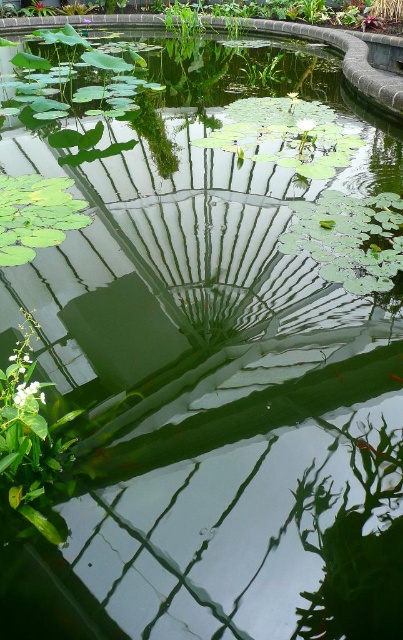
Does green leafy plant at lower right have a greater height compared to green leafy plant at upper center?

Incorrect, green leafy plant at lower right's height is not larger of green leafy plant at upper center's.

Is green leafy plant at lower right below green leafy plant at upper center?

Yes, green leafy plant at lower right is below green leafy plant at upper center.

Does point (386, 604) come behind point (342, 26)?

No.

Where is `green leafy plant at lower right`? green leafy plant at lower right is located at coordinates (355, 544).

Is green leafy plant at lower right thinner than green glossy lily pad at upper left?

Yes, green leafy plant at lower right is thinner than green glossy lily pad at upper left.

Which of these two, green leafy plant at lower right or green glossy lily pad at upper left, stands taller?

With more height is green glossy lily pad at upper left.

The image size is (403, 640). Describe the element at coordinates (355, 544) in the screenshot. I see `green leafy plant at lower right` at that location.

The height and width of the screenshot is (640, 403). Identify the location of green leafy plant at lower right. (355, 544).

Measure the distance between green leafy plant at upper center and camera.

12.11 meters

Find the location of a particular element. The image size is (403, 640). green leafy plant at upper center is located at coordinates (313, 13).